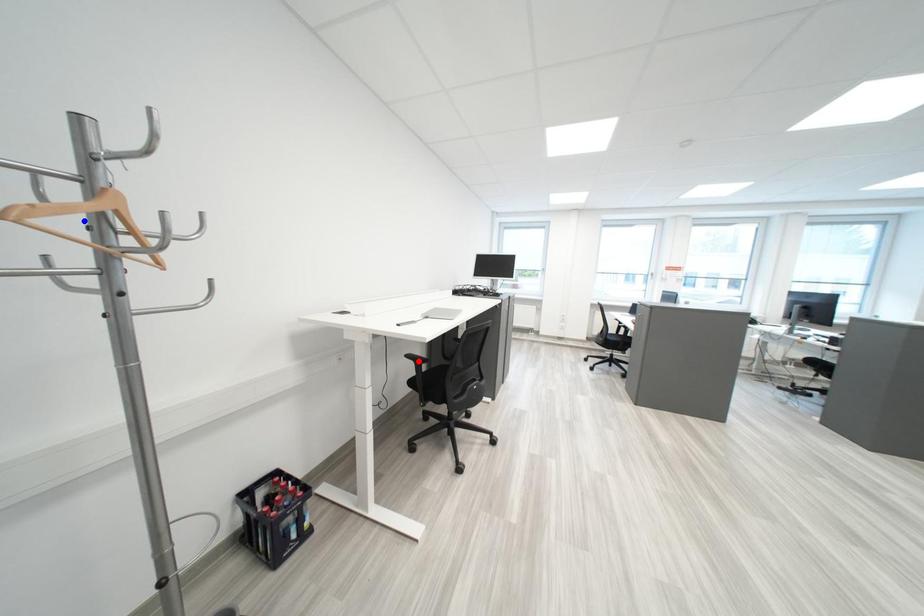
Question: Two points are marked on the image. Which point is closer to the camera?

Choices:
 (A) Blue point is closer.
 (B) Red point is closer.

Answer: (A)